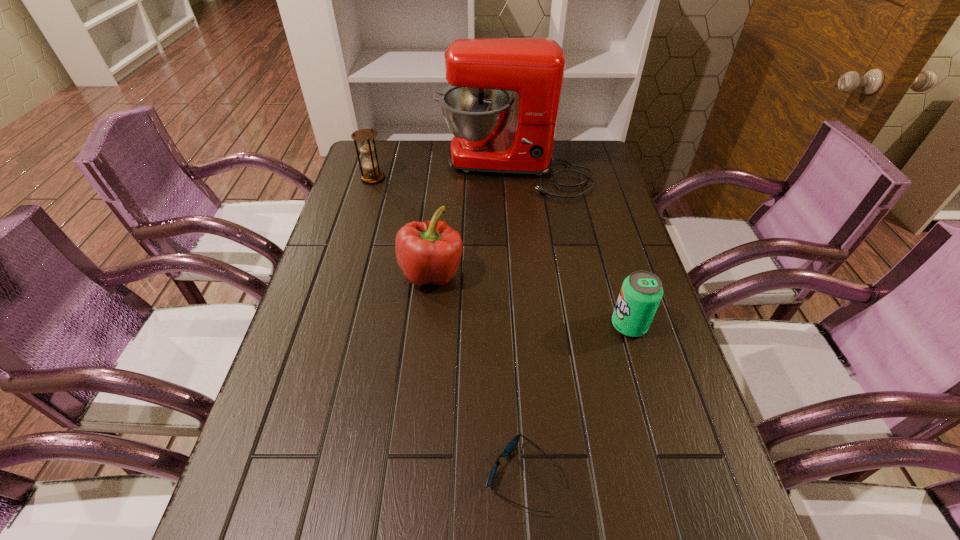
Identify the location of vacant space in between the pop soda and the bell pepper. The height and width of the screenshot is (540, 960). pyautogui.click(x=530, y=299).

Locate an element on the screen. vacant space in between the leftmost object and the bell pepper is located at coordinates pyautogui.click(x=402, y=226).

The height and width of the screenshot is (540, 960). I want to click on free point between the kitchen mixer and the shortest object, so click(518, 323).

In order to click on empty space between the nearest object and the bell pepper in this screenshot , I will do `click(477, 375)`.

Find the location of a particular element. Image resolution: width=960 pixels, height=540 pixels. empty location between the third farthest object and the pop soda is located at coordinates click(530, 299).

At what (x,y) coordinates should I click in order to perform the action: click on free space between the third farthest object and the pop soda. Please return your answer as a coordinate pair (x, y). This screenshot has width=960, height=540. Looking at the image, I should click on (530, 299).

I want to click on object that is the closest to the tallest object, so click(x=366, y=146).

Find the location of a particular element. This screenshot has width=960, height=540. the fourth closest object to the tallest object is located at coordinates (513, 443).

Locate an element on the screen. The height and width of the screenshot is (540, 960). vacant position in the image that satisfies the following two spatial constraints: 1. on the front side of the leftmost object; 2. on the right side of the third nearest object is located at coordinates (345, 273).

In order to click on free spot that satisfies the following two spatial constraints: 1. on the front-facing side of the kitchen mixer; 2. at the front of the nearest object showing the lenses in this screenshot , I will do `click(542, 476)`.